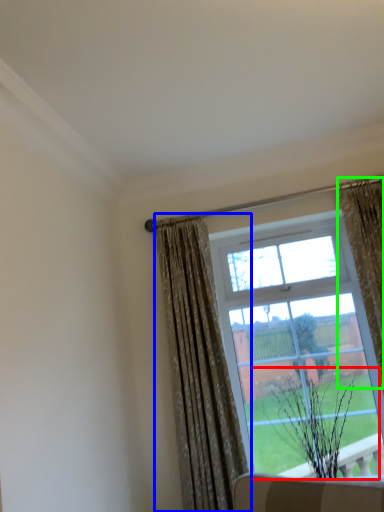
Question: Which object is the closest to the plant (highlighted by a red box)? Choose among these: curtain (highlighted by a blue box) or curtain (highlighted by a green box).

Choices:
 (A) curtain
 (B) curtain

Answer: (A)